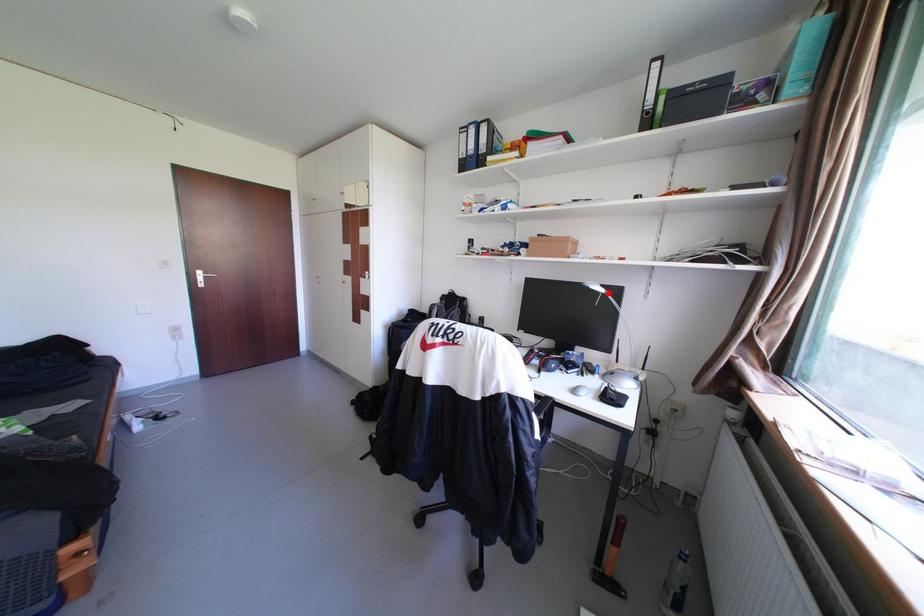
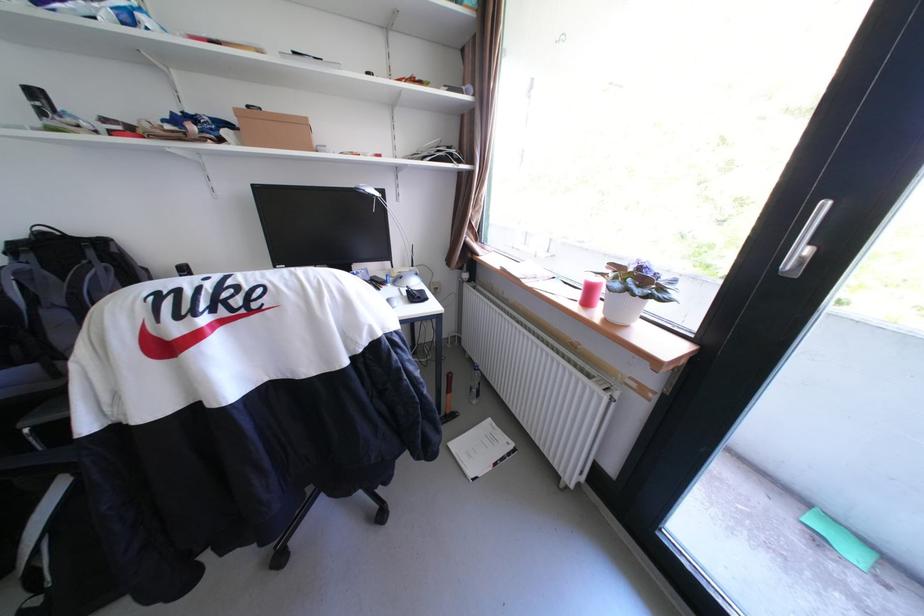
Question: I am providing you with two images of the same scene from different viewpoints. A red point is marked on the first image. At the location where the point appears in image 1, is it still visible in image 2?

Choices:
 (A) Yes
 (B) No

Answer: (A)